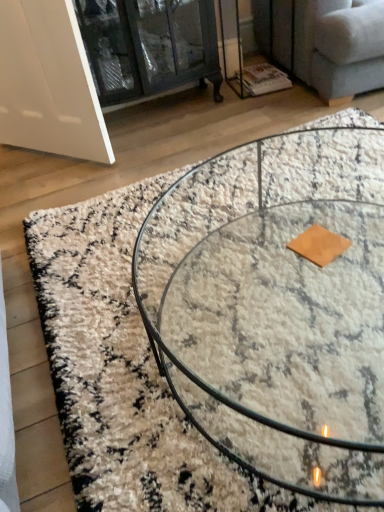
Where is `light gray fabric couch at upper right`? light gray fabric couch at upper right is located at coordinates (324, 42).

Does point (328, 93) come in front of point (317, 237)?

No, it is behind (317, 237).

Would you say light gray fabric couch at upper right contains clear glass coffee table at center?

No, clear glass coffee table at center is not inside light gray fabric couch at upper right.

From a real-world perspective, is light gray fabric couch at upper right on top of clear glass coffee table at center?

Yes, from a real-world perspective, light gray fabric couch at upper right is above clear glass coffee table at center.

Is clear glass coffee table at center not near clear glass cabinet at upper left?

Indeed, clear glass coffee table at center is not near clear glass cabinet at upper left.

Considering the relative sizes of clear glass coffee table at center and clear glass cabinet at upper left in the image provided, is clear glass coffee table at center taller than clear glass cabinet at upper left?

Incorrect, the height of clear glass coffee table at center is not larger of that of clear glass cabinet at upper left.

Considering the sizes of objects clear glass coffee table at center and clear glass cabinet at upper left in the image provided, who is smaller, clear glass coffee table at center or clear glass cabinet at upper left?

clear glass cabinet at upper left is smaller.

Image resolution: width=384 pixels, height=512 pixels. In order to click on coffee table directly beneath the clear glass cabinet at upper left (from a real-world perspective) in this screenshot , I will do `click(226, 396)`.

Locate an element on the screen. Image resolution: width=384 pixels, height=512 pixels. studio couch located on the right of clear glass coffee table at center is located at coordinates (324, 42).

Which of these two, clear glass coffee table at center or light gray fabric couch at upper right, is wider?

light gray fabric couch at upper right is wider.

Which of these two, clear glass coffee table at center or light gray fabric couch at upper right, stands taller?

light gray fabric couch at upper right.

Does point (303, 241) come farther from viewer compared to point (321, 91)?

That is False.

Can you confirm if light gray fabric couch at upper right is smaller than clear glass cabinet at upper left?

Actually, light gray fabric couch at upper right might be larger than clear glass cabinet at upper left.

Is light gray fabric couch at upper right facing away from clear glass cabinet at upper left?

No, clear glass cabinet at upper left is not at the back of light gray fabric couch at upper right.

Between light gray fabric couch at upper right and clear glass cabinet at upper left, which one appears on the left side from the viewer's perspective?

clear glass cabinet at upper left is more to the left.

Does clear glass cabinet at upper left contain light gray fabric couch at upper right?

No, light gray fabric couch at upper right is not a part of clear glass cabinet at upper left.

Does clear glass cabinet at upper left appear on the right side of light gray fabric couch at upper right?

No, clear glass cabinet at upper left is not to the right of light gray fabric couch at upper right.

Based on the photo, how different are the orientations of clear glass cabinet at upper left and light gray fabric couch at upper right in degrees?

6.09 degrees separate the facing orientations of clear glass cabinet at upper left and light gray fabric couch at upper right.

Could you tell me if clear glass cabinet at upper left is facing light gray fabric couch at upper right?

Result: No, clear glass cabinet at upper left is not facing towards light gray fabric couch at upper right.

Is clear glass cabinet at upper left in contact with clear glass coffee table at center?

No, clear glass cabinet at upper left is not with clear glass coffee table at center.

The image size is (384, 512). I want to click on coffee table below the clear glass cabinet at upper left (from the image's perspective), so click(x=226, y=396).

Is point (120, 3) closer or farther from the camera than point (349, 128)?

Point (120, 3).

Find the location of a particular element. The width and height of the screenshot is (384, 512). studio couch located on the right of clear glass coffee table at center is located at coordinates (324, 42).

Image resolution: width=384 pixels, height=512 pixels. Find the location of `coffee table in front of the clear glass cabinet at upper left`. coffee table in front of the clear glass cabinet at upper left is located at coordinates (226, 396).

Considering their positions, is light gray fabric couch at upper right positioned further to clear glass cabinet at upper left than clear glass coffee table at center?

clear glass coffee table at center is further to clear glass cabinet at upper left.

When comparing their distances from clear glass coffee table at center, does clear glass cabinet at upper left or light gray fabric couch at upper right seem closer?

Among the two, light gray fabric couch at upper right is located nearer to clear glass coffee table at center.

Which object lies nearer to the anchor point light gray fabric couch at upper right, clear glass cabinet at upper left or clear glass coffee table at center?

Among the two, clear glass cabinet at upper left is located nearer to light gray fabric couch at upper right.

Based on their spatial positions, is light gray fabric couch at upper right or clear glass cabinet at upper left further from clear glass coffee table at center?

Based on the image, clear glass cabinet at upper left appears to be further to clear glass coffee table at center.

Estimate the real-world distances between objects in this image. Which object is further from light gray fabric couch at upper right, clear glass coffee table at center or clear glass cabinet at upper left?

clear glass coffee table at center is further to light gray fabric couch at upper right.

From the image, which object appears to be farther from clear glass cabinet at upper left, clear glass coffee table at center or light gray fabric couch at upper right?

Based on the image, clear glass coffee table at center appears to be further to clear glass cabinet at upper left.

Locate an element on the screen. Image resolution: width=384 pixels, height=512 pixels. glass door between light gray fabric couch at upper right and clear glass coffee table at center in the vertical direction is located at coordinates (148, 46).